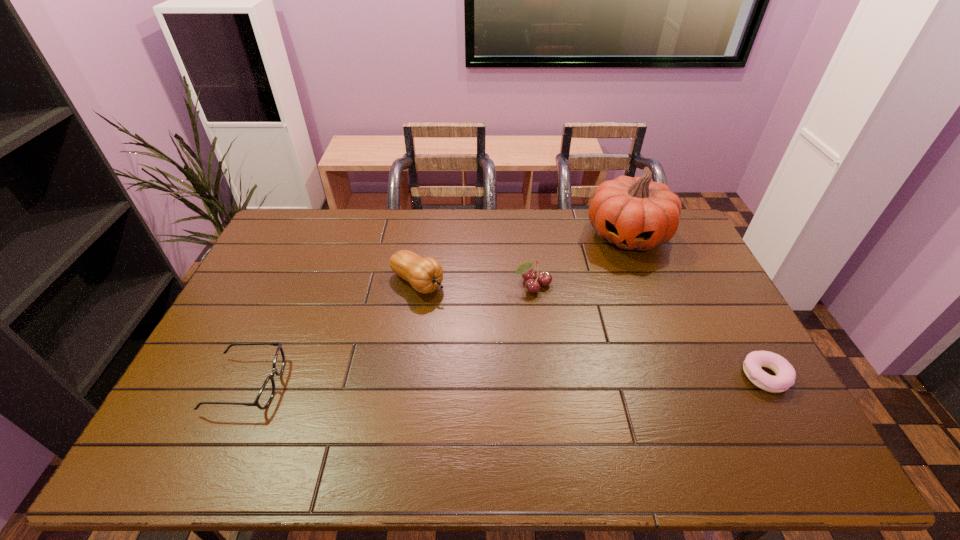
The width and height of the screenshot is (960, 540). What are the coordinates of `doughnut at the near edge` in the screenshot? It's located at (785, 377).

Where is `object situated at the left edge`? object situated at the left edge is located at coordinates (267, 391).

Image resolution: width=960 pixels, height=540 pixels. In order to click on doughnut located in the right edge section of the desktop in this screenshot , I will do `click(785, 377)`.

Where is `pumpkin located in the right edge section of the desktop`? The width and height of the screenshot is (960, 540). pumpkin located in the right edge section of the desktop is located at coordinates (633, 213).

In order to click on object situated at the near left corner in this screenshot , I will do `click(267, 391)`.

Locate an element on the screen. This screenshot has width=960, height=540. object at the far right corner is located at coordinates (x=633, y=213).

Where is `object that is at the near right corner`? object that is at the near right corner is located at coordinates (785, 377).

Locate an element on the screen. vacant space at the far edge is located at coordinates (487, 218).

Find the location of `vacant space at the near edge`. vacant space at the near edge is located at coordinates (600, 411).

I want to click on vacant region at the right edge of the desktop, so click(736, 381).